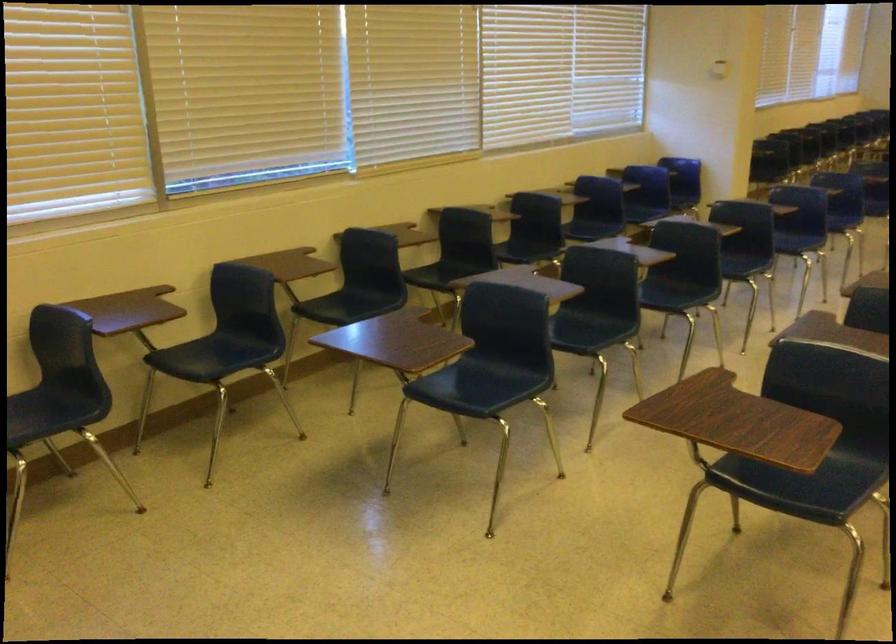
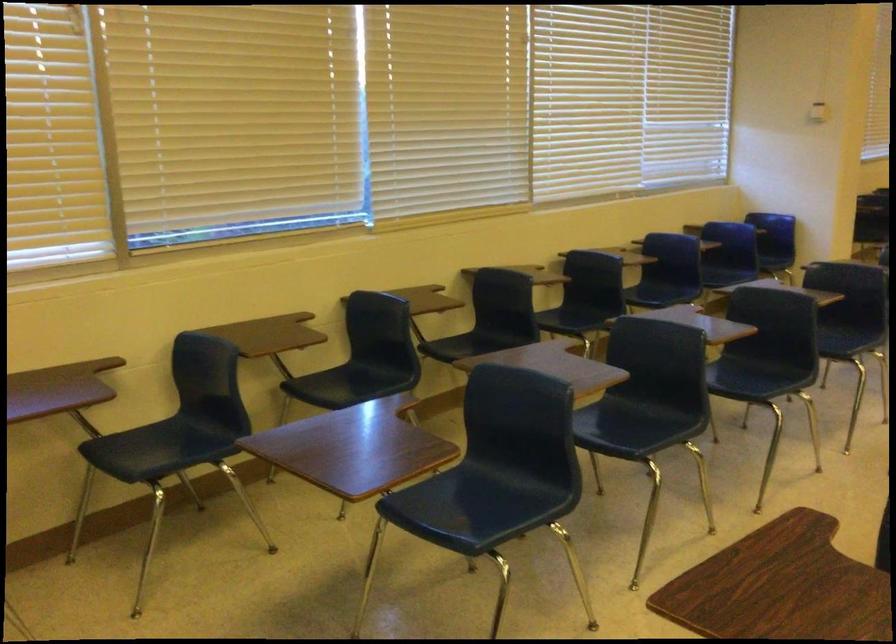
Question: The camera is either moving clockwise (left) or counter-clockwise (right) around the object. The first image is from the beginning of the video and the second image is from the end. Is the camera moving left or right when shooting the video?

Choices:
 (A) Left
 (B) Right

Answer: (B)